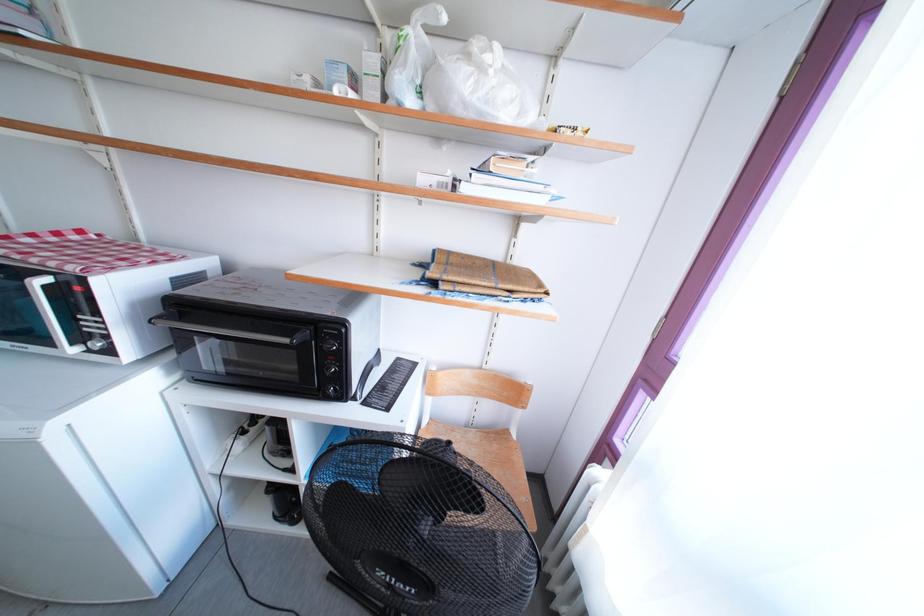
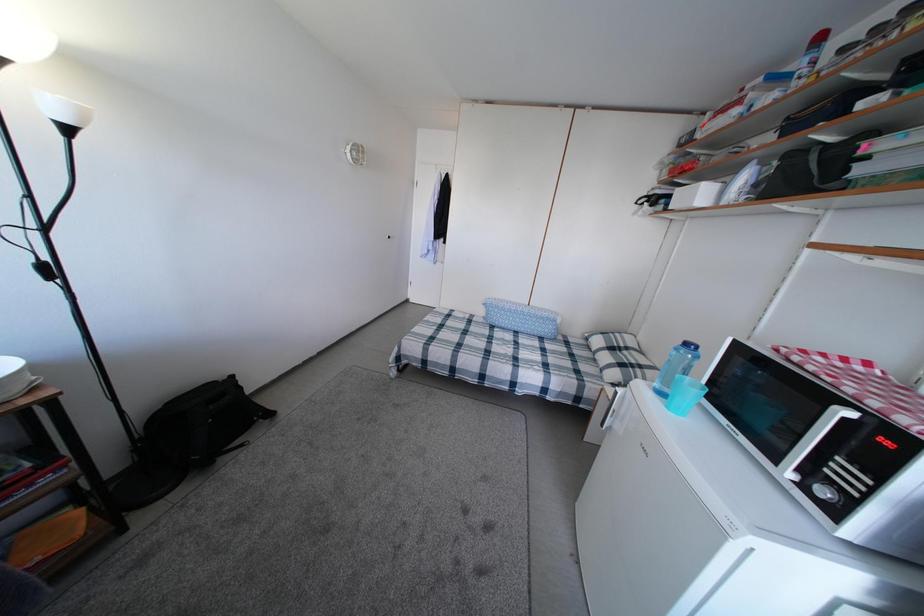
Question: The camera is either moving clockwise (left) or counter-clockwise (right) around the object. The first image is from the beginning of the video and the second image is from the end. Is the camera moving left or right when shooting the video?

Choices:
 (A) Left
 (B) Right

Answer: (B)